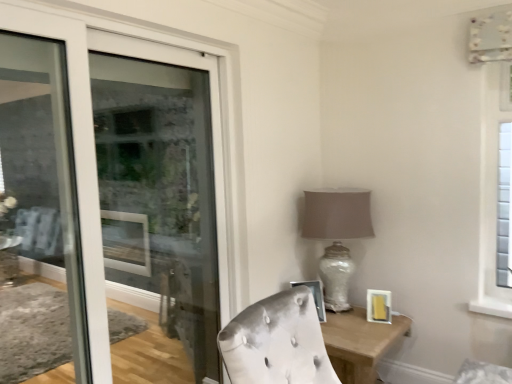
Question: Which direction should I rotate to face metallic silver picture frame at center, which is the 1th picture frame in left-to-right order, — up or down?

Choices:
 (A) down
 (B) up

Answer: (A)

Question: Is metallic silver picture frame at center, arranged as the 2th picture frame when viewed from the right, located within matte gold picture frame at lower right, acting as the second picture frame starting from the left?

Choices:
 (A) no
 (B) yes

Answer: (A)

Question: Is matte gold picture frame at lower right, which is the 1th picture frame from right to left, positioned beyond the bounds of metallic silver picture frame at center, which is the 1th picture frame in left-to-right order?

Choices:
 (A) no
 (B) yes

Answer: (B)

Question: Considering the relative positions of matte gold picture frame at lower right, which is the 1th picture frame from right to left, and metallic silver picture frame at center, arranged as the 2th picture frame when viewed from the right, in the image provided, is matte gold picture frame at lower right, which is the 1th picture frame from right to left, to the left of metallic silver picture frame at center, arranged as the 2th picture frame when viewed from the right, from the viewer's perspective?

Choices:
 (A) no
 (B) yes

Answer: (A)

Question: From the image's perspective, does matte gold picture frame at lower right, acting as the second picture frame starting from the left, appear lower than metallic silver picture frame at center, arranged as the 2th picture frame when viewed from the right?

Choices:
 (A) yes
 (B) no

Answer: (A)

Question: Can you confirm if matte gold picture frame at lower right, acting as the second picture frame starting from the left, is taller than metallic silver picture frame at center, which is the 1th picture frame in left-to-right order?

Choices:
 (A) no
 (B) yes

Answer: (A)

Question: Is matte gold picture frame at lower right, which is the 1th picture frame from right to left, looking in the opposite direction of metallic silver picture frame at center, which is the 1th picture frame in left-to-right order?

Choices:
 (A) yes
 (B) no

Answer: (B)

Question: Is metallic silver picture frame at center, which is the 1th picture frame in left-to-right order, at the back of wooden table at lower right?

Choices:
 (A) no
 (B) yes

Answer: (A)

Question: From the image's perspective, would you say wooden table at lower right is shown under metallic silver picture frame at center, which is the 1th picture frame in left-to-right order?

Choices:
 (A) no
 (B) yes

Answer: (B)

Question: Is wooden table at lower right to the right of metallic silver picture frame at center, arranged as the 2th picture frame when viewed from the right, from the viewer's perspective?

Choices:
 (A) no
 (B) yes

Answer: (B)

Question: Is wooden table at lower right bigger than metallic silver picture frame at center, arranged as the 2th picture frame when viewed from the right?

Choices:
 (A) yes
 (B) no

Answer: (A)

Question: Is wooden table at lower right touching metallic silver picture frame at center, which is the 1th picture frame in left-to-right order?

Choices:
 (A) no
 (B) yes

Answer: (A)

Question: Is wooden table at lower right located outside metallic silver picture frame at center, arranged as the 2th picture frame when viewed from the right?

Choices:
 (A) yes
 (B) no

Answer: (A)

Question: Is wooden table at lower right inside metallic silver picture frame at center, arranged as the 2th picture frame when viewed from the right?

Choices:
 (A) no
 (B) yes

Answer: (A)